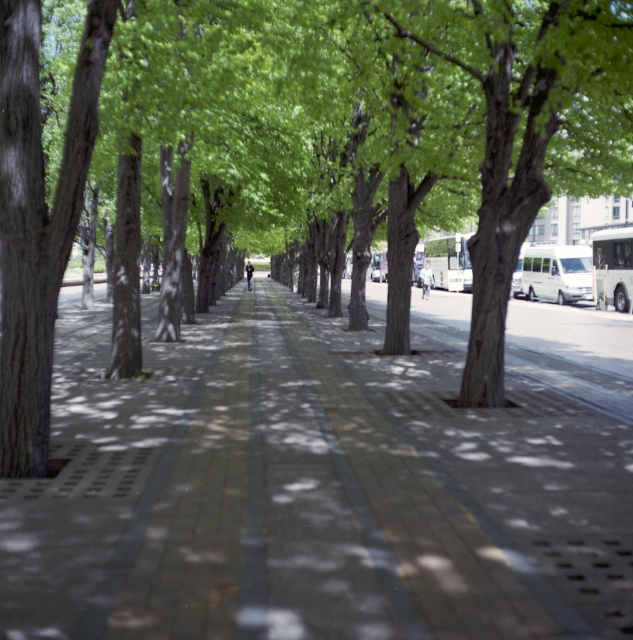
Question: Which point is farther to the camera?

Choices:
 (A) brick pavement at center
 (B) brown textured tree at center

Answer: (B)

Question: Does brick pavement at center come behind brown textured tree at center?

Choices:
 (A) yes
 (B) no

Answer: (B)

Question: Does brick pavement at center have a smaller size compared to brown textured tree at center?

Choices:
 (A) yes
 (B) no

Answer: (A)

Question: Which of the following is the farthest from the observer?

Choices:
 (A) brick pavement at center
 (B) brown textured tree at center

Answer: (B)

Question: Is brick pavement at center positioned in front of brown textured tree at center?

Choices:
 (A) yes
 (B) no

Answer: (A)